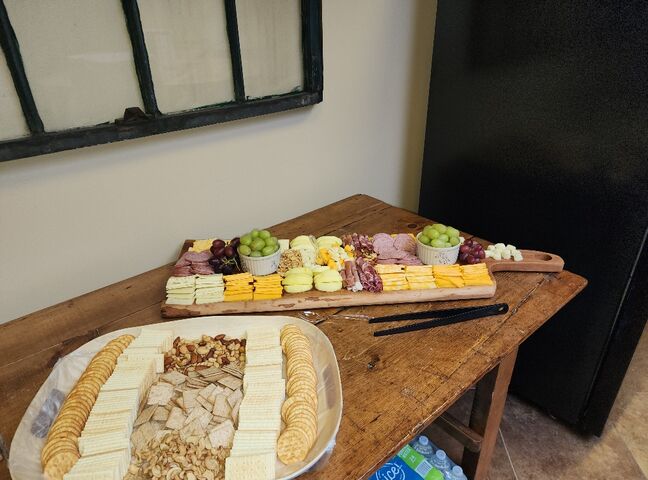
At what (x,y) coordinates should I click in order to perform the action: click on floor. Please return your answer as a coordinate pair (x, y). Looking at the image, I should click on (548, 450).